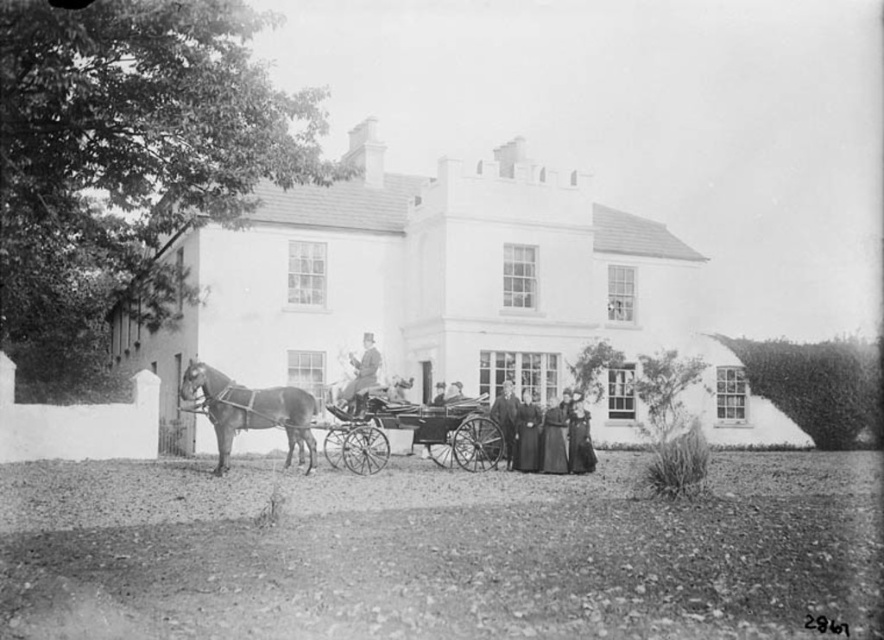
You are a guest at this historical event and need to decide whether to place your luggage on the wooden polished cart at center or the dark brown velvet dress at center. Based on their sizes, which one can accommodate your luggage better?

The wooden polished cart at center is larger in size than the dark brown velvet dress at center, so the wooden polished cart at center can accommodate your luggage better.